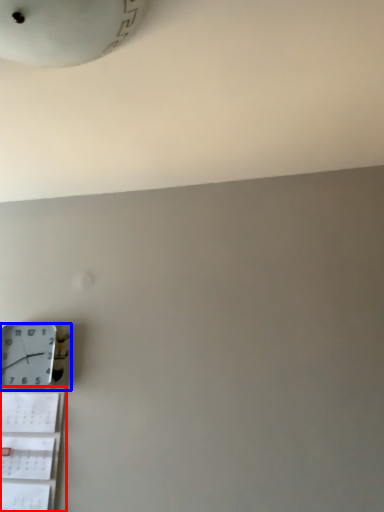
Question: Which of the following is the closest to the observer, shelf (highlighted by a red box) or wall clock (highlighted by a blue box)?

Choices:
 (A) shelf
 (B) wall clock

Answer: (A)